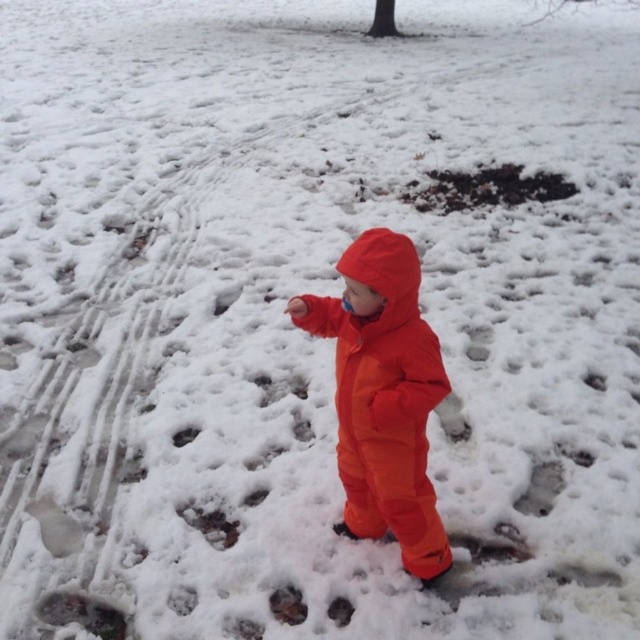
Question: Which point appears closest to the camera in this image?

Choices:
 (A) (400, 369)
 (B) (429, 198)

Answer: (A)

Question: Does orange waterproof snowsuit at center have a greater width compared to brown dirt at center?

Choices:
 (A) yes
 (B) no

Answer: (B)

Question: Which point is closer to the camera?

Choices:
 (A) brown dirt at center
 (B) orange waterproof snowsuit at center

Answer: (B)

Question: Does orange waterproof snowsuit at center have a lesser width compared to brown dirt at center?

Choices:
 (A) yes
 (B) no

Answer: (A)

Question: In this image, where is orange waterproof snowsuit at center located relative to brown dirt at center?

Choices:
 (A) below
 (B) above

Answer: (A)

Question: Which point is closer to the camera?

Choices:
 (A) orange waterproof snowsuit at center
 (B) brown dirt at center

Answer: (A)